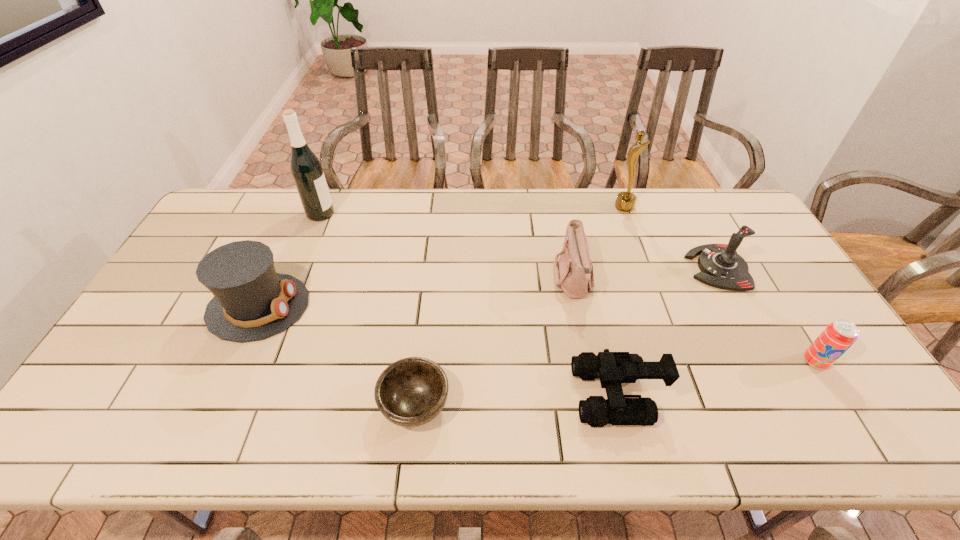
Find the location of `object located in the left edge section of the desktop`. object located in the left edge section of the desktop is located at coordinates (251, 302).

Find the location of a particular element. This screenshot has height=540, width=960. joystick situated at the right edge is located at coordinates (721, 266).

This screenshot has width=960, height=540. In order to click on soda can at the right edge in this screenshot , I will do `click(840, 335)`.

Locate an element on the screen. The image size is (960, 540). free space at the far edge is located at coordinates (283, 228).

At what (x,y) coordinates should I click in order to perform the action: click on free region at the near edge of the desktop. Please return your answer as a coordinate pair (x, y). Looking at the image, I should click on (627, 437).

Where is `vacant space at the left edge of the desktop`? The height and width of the screenshot is (540, 960). vacant space at the left edge of the desktop is located at coordinates (178, 334).

Locate an element on the screen. The image size is (960, 540). vacant space at the far right corner is located at coordinates (707, 193).

Find the location of a particular element. The width and height of the screenshot is (960, 540). vacant point located between the seventh object from left to right and the tallest object is located at coordinates (518, 241).

The width and height of the screenshot is (960, 540). Find the location of `empty space that is in between the soda can and the dress hat`. empty space that is in between the soda can and the dress hat is located at coordinates (537, 334).

I want to click on free space between the soda can and the shoulder bag, so click(694, 321).